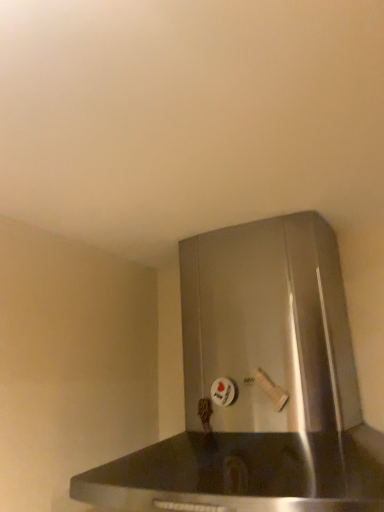
Where is `stainless steel range hood at center`? stainless steel range hood at center is located at coordinates 258,385.

Describe the element at coordinates (258, 385) in the screenshot. This screenshot has height=512, width=384. I see `stainless steel range hood at center` at that location.

Measure the distance between point (289, 330) and camera.

A distance of 34.57 inches exists between point (289, 330) and camera.

The height and width of the screenshot is (512, 384). I want to click on stainless steel range hood at center, so click(258, 385).